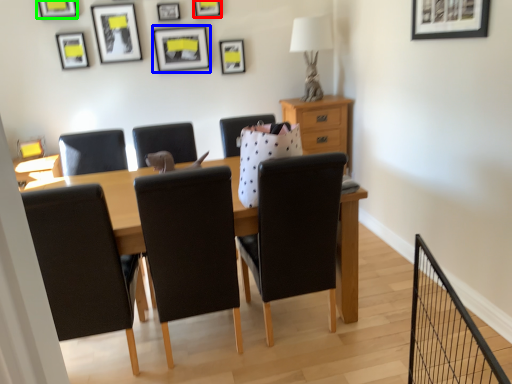
Question: Which object is positioned closest to picture frame (highlighted by a red box)? Select from picture frame (highlighted by a blue box) and picture frame (highlighted by a green box).

Choices:
 (A) picture frame
 (B) picture frame

Answer: (A)